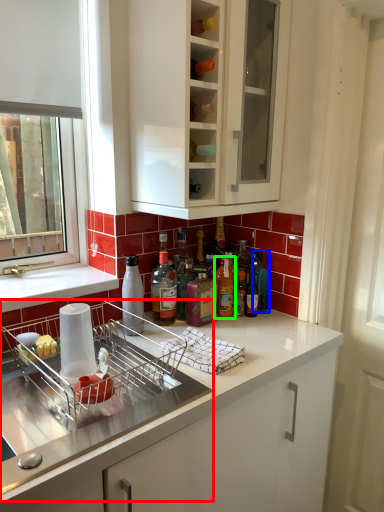
Question: Which object is positioned farthest from dish washer (highlighted by a red box)? Select from bottle (highlighted by a blue box) and bottle (highlighted by a green box).

Choices:
 (A) bottle
 (B) bottle

Answer: (A)